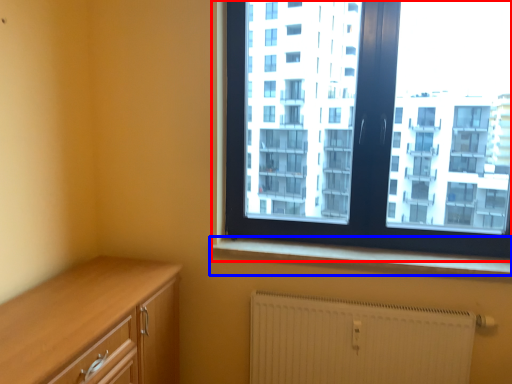
Question: Among these objects, which one is nearest to the camera, window (highlighted by a red box) or window sill (highlighted by a blue box)?

Choices:
 (A) window
 (B) window sill

Answer: (A)